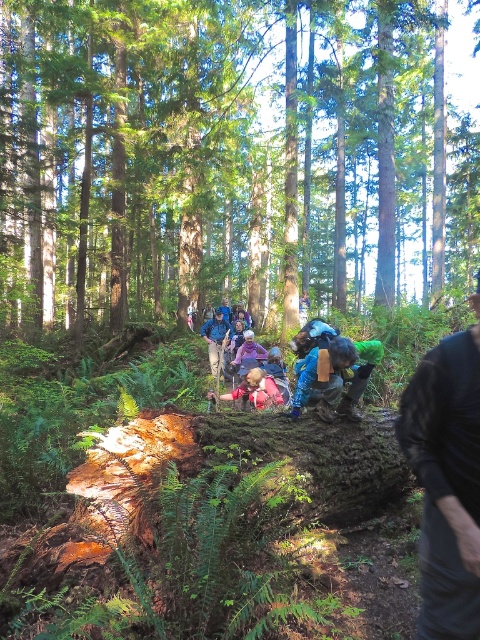
Question: Does brown mossy log at center have a greater width compared to blue fabric jacket at center?

Choices:
 (A) no
 (B) yes

Answer: (B)

Question: Can you confirm if brown mossy log at center is bigger than blue fabric jacket at center?

Choices:
 (A) no
 (B) yes

Answer: (B)

Question: Which of the following is the farthest from the observer?

Choices:
 (A) (213, 397)
 (B) (171, 168)
 (C) (475, 422)
 (D) (248, 337)

Answer: (B)

Question: Estimate the real-world distances between objects in this image. Which object is closer to the pink fabric at center?

Choices:
 (A) dark blue fabric jacket at lower right
 (B) brown mossy log at center
 (C) blue fabric backpack at center

Answer: (C)

Question: Among these points, which one is farthest from the camera?

Choices:
 (A) (207, 342)
 (B) (462, 532)

Answer: (A)

Question: Is blue fabric jacket at center to the left of purple fabric at center from the viewer's perspective?

Choices:
 (A) no
 (B) yes

Answer: (B)